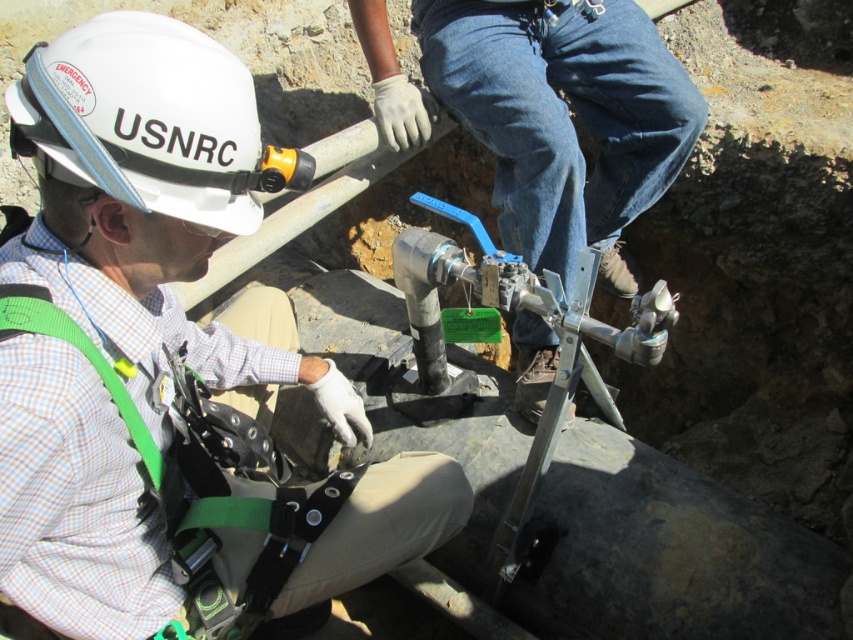
Question: In this image, where is metallic silver valve at center located relative to white hard hat at upper left?

Choices:
 (A) right
 (B) left

Answer: (A)

Question: Is metallic silver valve at center smaller than white hard hat at upper left?

Choices:
 (A) no
 (B) yes

Answer: (A)

Question: Does metallic silver valve at center have a larger size compared to white hard hat at upper left?

Choices:
 (A) no
 (B) yes

Answer: (B)

Question: Which point is farther to the camera?

Choices:
 (A) white hard hat at upper left
 (B) metallic silver valve at center

Answer: (B)

Question: Which point is farther from the camera taking this photo?

Choices:
 (A) (247, 72)
 (B) (379, 0)

Answer: (B)